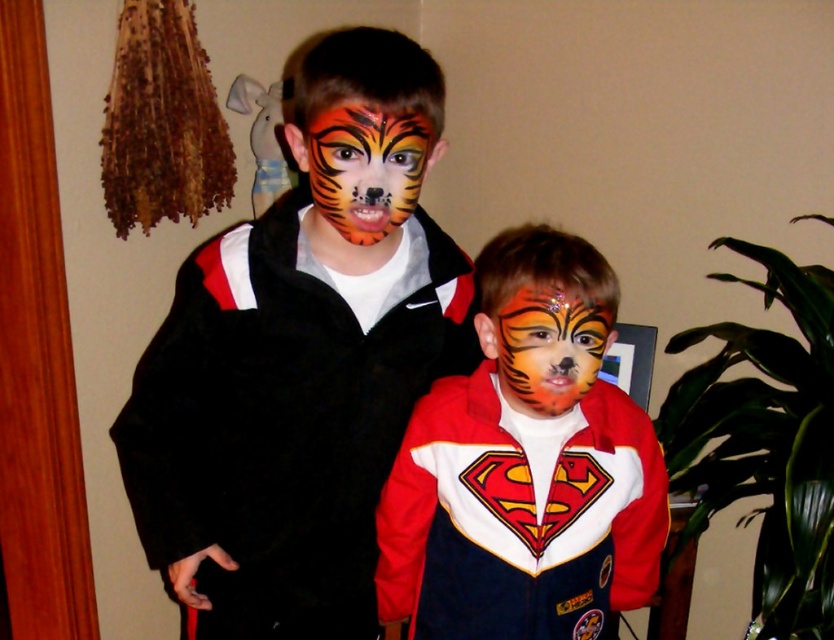
Can you confirm if matte red jacket at center is positioned below orange matte tiger face paint at center?

Yes.

Can you confirm if matte red jacket at center is positioned to the right of orange matte tiger face paint at center?

Correct, you'll find matte red jacket at center to the right of orange matte tiger face paint at center.

The image size is (834, 640). Describe the element at coordinates (525, 465) in the screenshot. I see `matte red jacket at center` at that location.

Find the location of `matte red jacket at center`. matte red jacket at center is located at coordinates (525, 465).

This screenshot has width=834, height=640. What do you see at coordinates (300, 360) in the screenshot?
I see `matte black jacket at left` at bounding box center [300, 360].

Who is more distant from viewer, (418, 164) or (568, 637)?

Point (568, 637)

Is point (294, 483) closer to viewer compared to point (420, 484)?

That is False.

This screenshot has height=640, width=834. Identify the location of matte black jacket at left. pos(300,360).

Between point (614, 525) and point (604, 344), which one is positioned behind?

The point (614, 525) is more distant.

Which is above, matte red jacket at center or shiny orange tiger face paint at center?

shiny orange tiger face paint at center is higher up.

Locate an element on the screen. matte red jacket at center is located at coordinates (525, 465).